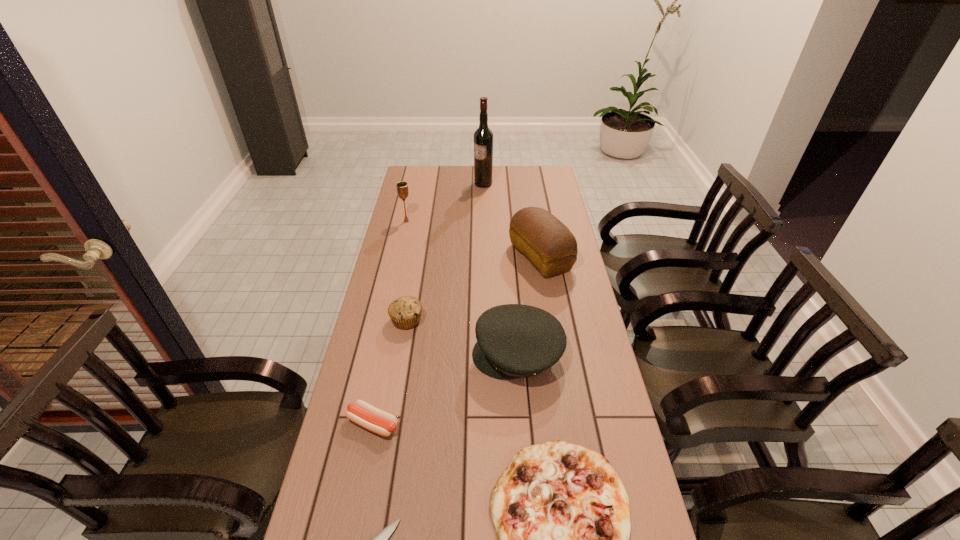
The height and width of the screenshot is (540, 960). Find the location of `the tallest object`. the tallest object is located at coordinates (483, 137).

Locate an element on the screen. The image size is (960, 540). the farthest object is located at coordinates (483, 137).

The height and width of the screenshot is (540, 960). I want to click on chalice, so click(402, 187).

At what (x,y) coordinates should I click in order to perform the action: click on bread. Please return your answer as a coordinate pair (x, y). Looking at the image, I should click on (549, 245).

I want to click on the fifth shortest object, so click(x=514, y=341).

At what (x,y) coordinates should I click in order to perform the action: click on muffin. Please return your answer as a coordinate pair (x, y). Image resolution: width=960 pixels, height=540 pixels. Looking at the image, I should click on click(x=405, y=312).

This screenshot has width=960, height=540. In order to click on sausage in this screenshot , I will do `click(369, 417)`.

This screenshot has width=960, height=540. Identify the location of vacant space located on the front and back of the tallest object. (417, 184).

I want to click on vacant position located 0.050m on the front and back of the tallest object, so click(x=464, y=184).

Identify the location of vacant area located 0.130m on the front and back of the tallest object. (447, 184).